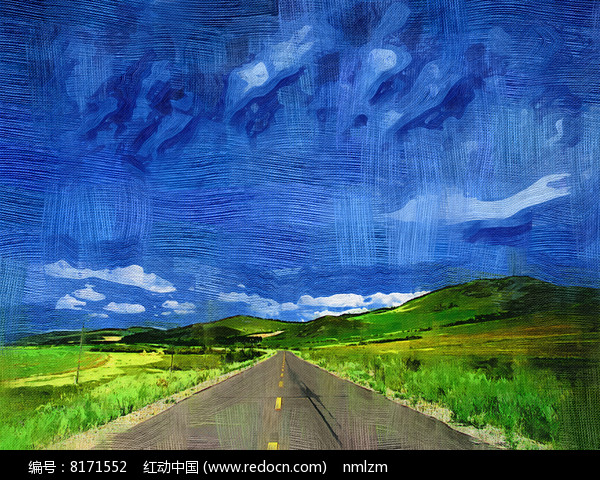
Where is `painting`? painting is located at coordinates [261, 255].